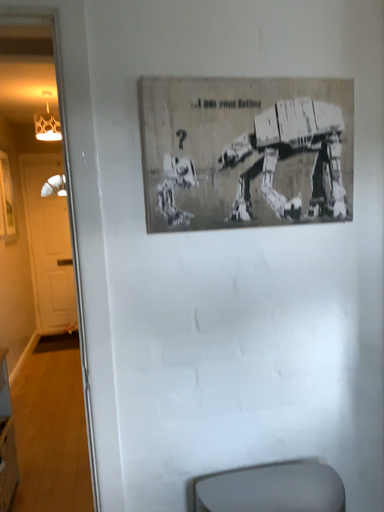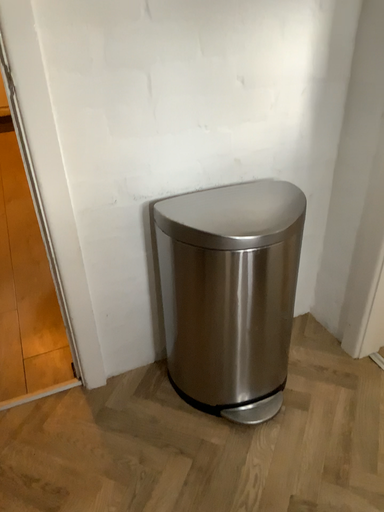
Question: Which way did the camera rotate in the video?

Choices:
 (A) rotated upward
 (B) rotated downward

Answer: (B)